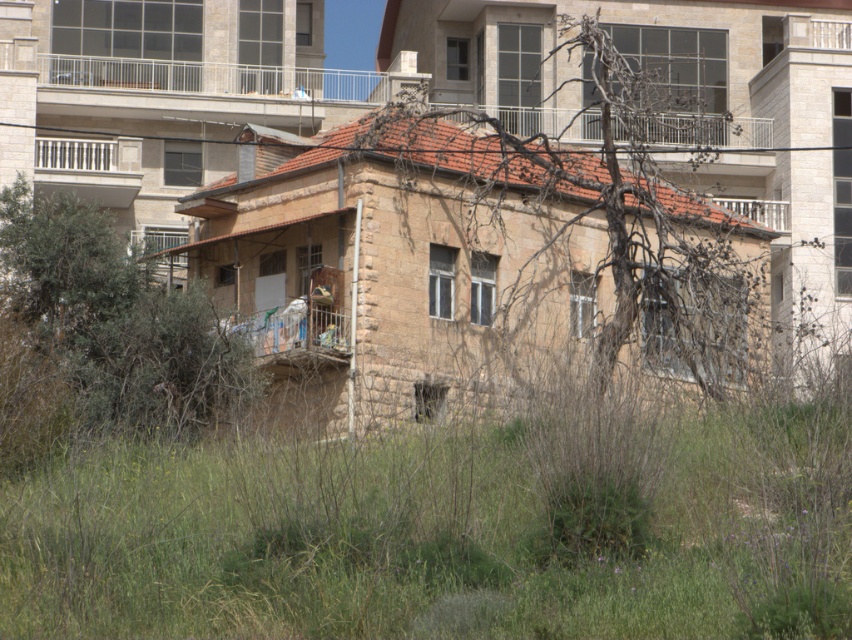
Does white stone balcony at upper left have a greater width compared to white metal balcony at upper right?

Indeed, white stone balcony at upper left has a greater width compared to white metal balcony at upper right.

Who is more distant from viewer, (x=101, y=147) or (x=758, y=212)?

Point (x=758, y=212)

Identify the location of white stone balcony at upper left. This screenshot has height=640, width=852. (87, 154).

Does white metal railing at upper center have a lesser width compared to white stone balcony at upper left?

In fact, white metal railing at upper center might be wider than white stone balcony at upper left.

Can you confirm if white metal railing at upper center is wider than white stone balcony at upper left?

Indeed, white metal railing at upper center has a greater width compared to white stone balcony at upper left.

Describe the element at coordinates (223, 80) in the screenshot. This screenshot has width=852, height=640. I see `white metal railing at upper center` at that location.

Locate an element on the screen. This screenshot has width=852, height=640. white metal railing at upper center is located at coordinates (223, 80).

Does white metal railing at upper center have a smaller size compared to metallic silver balcony at upper center?

Yes.

Is point (301, 68) in front of point (560, 122)?

That is False.

Who is more distant from viewer, (56, 60) or (446, 102)?

The point (446, 102) is behind.

Where is `white metal railing at upper center`? The height and width of the screenshot is (640, 852). white metal railing at upper center is located at coordinates (223, 80).